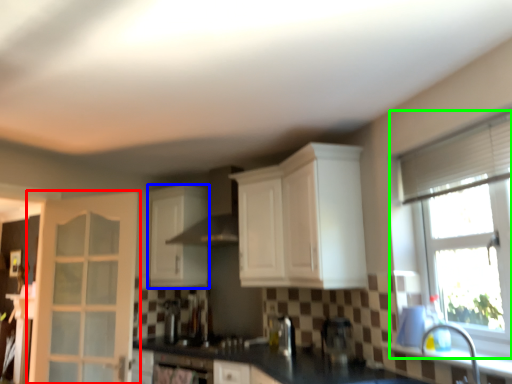
Question: Considering the real-world distances, which object is closest to door (highlighted by a red box)? cabinetry (highlighted by a blue box) or window (highlighted by a green box).

Choices:
 (A) cabinetry
 (B) window

Answer: (A)